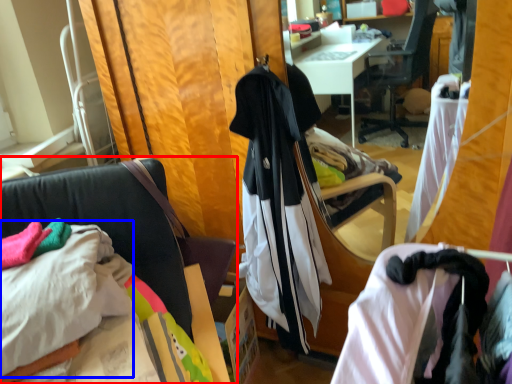
Question: Which of the following is the closest to the observer, chair (highlighted by a red box) or sheet (highlighted by a blue box)?

Choices:
 (A) chair
 (B) sheet

Answer: (A)